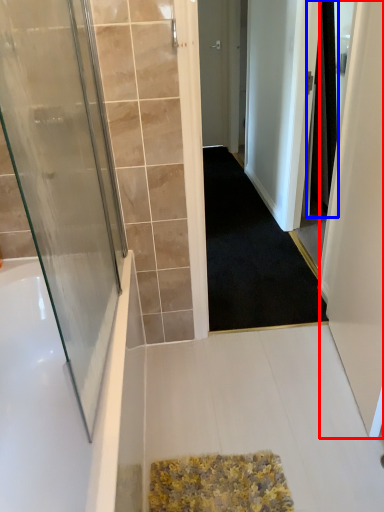
Question: Which object is closer to the camera taking this photo, screen door (highlighted by a red box) or shower curtain (highlighted by a blue box)?

Choices:
 (A) screen door
 (B) shower curtain

Answer: (A)